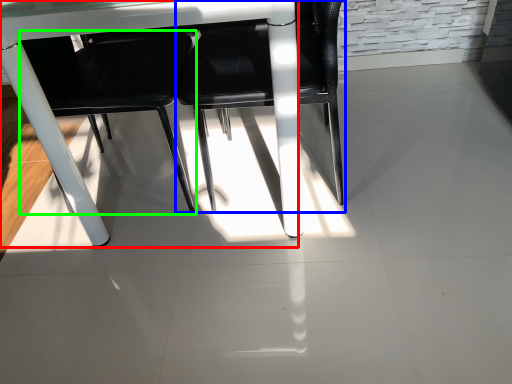
Question: Which object is positioned farthest from table (highlighted by a red box)? Select from chair (highlighted by a blue box) and chair (highlighted by a green box).

Choices:
 (A) chair
 (B) chair

Answer: (B)